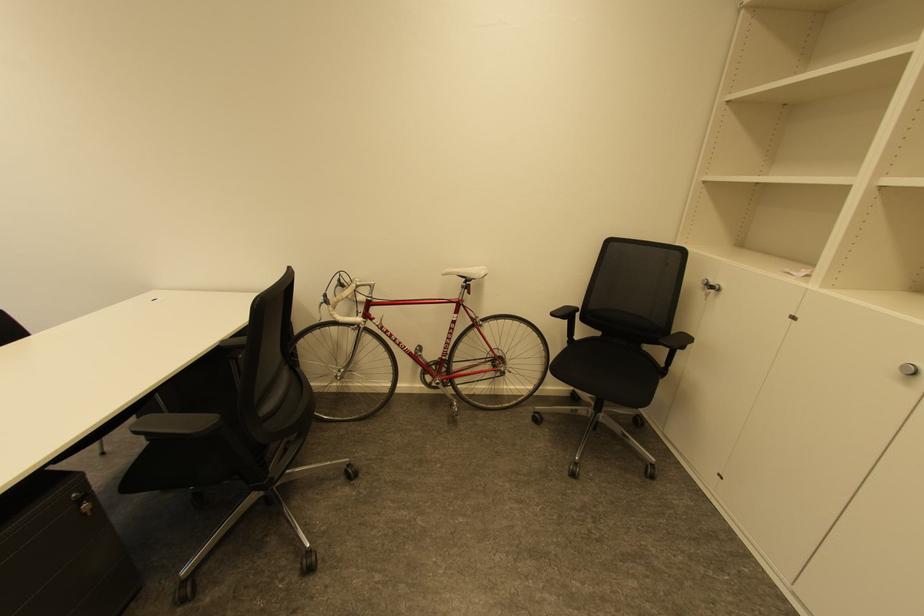
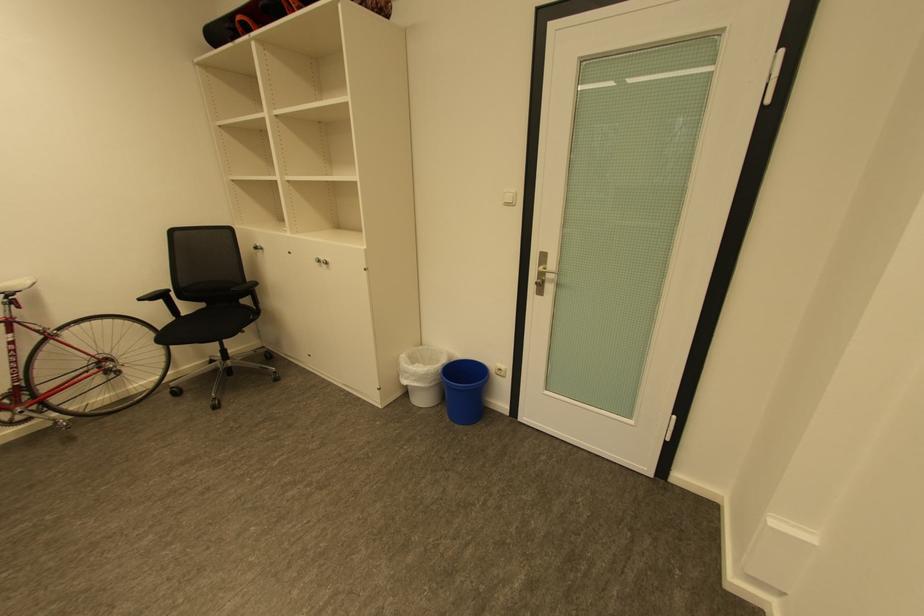
Locate, in the second image, the point that corresponds to (560,315) in the first image.

(148, 300)